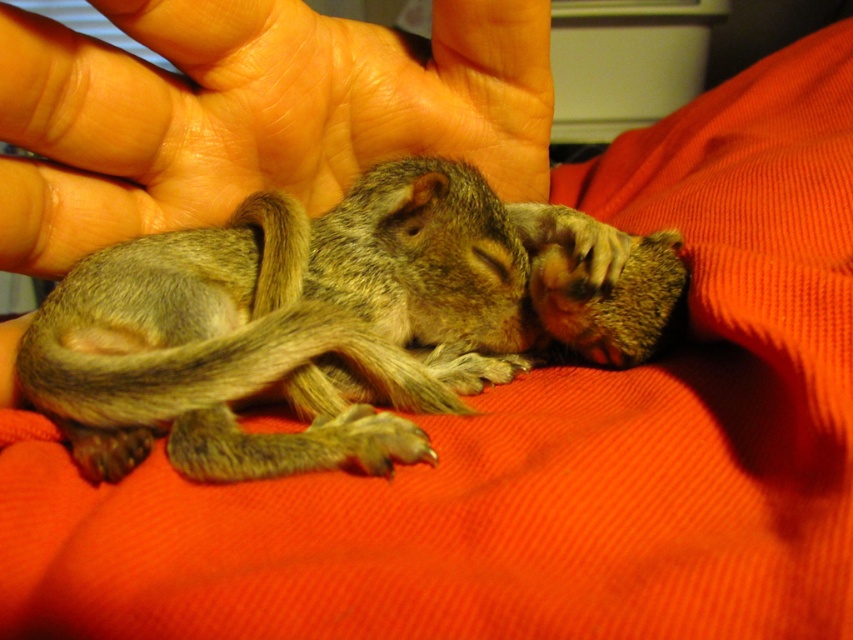
Can you confirm if soft brown fur squirrel at center is shorter than flesh-toned skin at center?

Indeed, soft brown fur squirrel at center has a lesser height compared to flesh-toned skin at center.

Is point (154, 360) positioned after point (15, 240)?

No, (154, 360) is in front of (15, 240).

Between point (370, 304) and point (10, 260), which one is positioned in front?

Point (10, 260) is in front.

You are a GUI agent. You are given a task and a screenshot of the screen. Output one action in this format:
    pyautogui.click(x=<x>, y=<y>)
    Task: Click on the soft brown fur squirrel at center
    The image size is (853, 640).
    Given the screenshot: What is the action you would take?
    pyautogui.click(x=332, y=321)